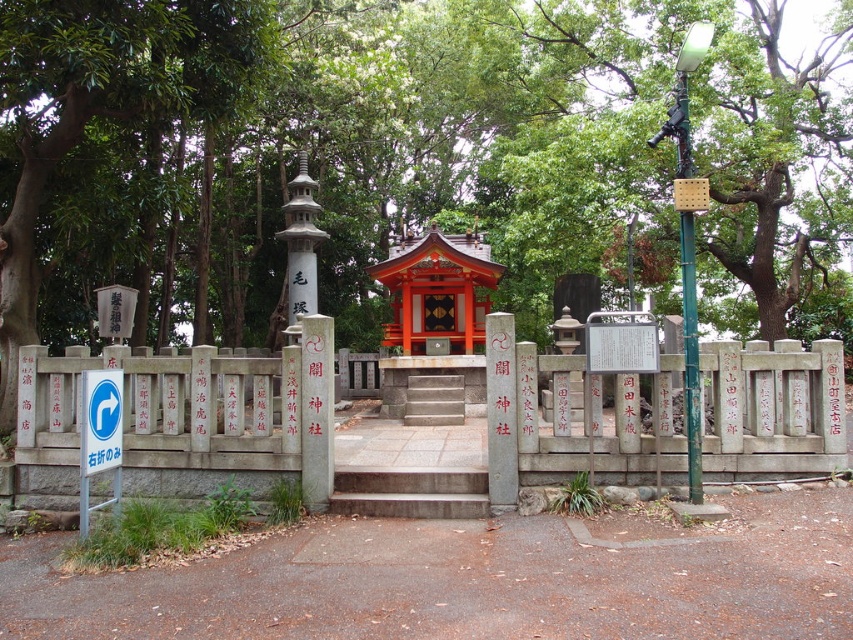
Question: Does gray stone fence at center lie in front of orange lacquered shrine at center?

Choices:
 (A) yes
 (B) no

Answer: (A)

Question: Which of these objects is positioned farthest from the concrete stairs at center?

Choices:
 (A) gray stone fence at center
 (B) gray stone stairs at center

Answer: (B)

Question: Which of the following is the closest to the observer?

Choices:
 (A) (372, 506)
 (B) (213, 276)
 (C) (39, 387)

Answer: (A)

Question: Does orange lacquered shrine at center come in front of white plastic sign at center?

Choices:
 (A) no
 (B) yes

Answer: (A)

Question: Is green leafy tree at center closer to the viewer compared to concrete stairs at center?

Choices:
 (A) yes
 (B) no

Answer: (B)

Question: Which point is farther from the camera taking this photo?

Choices:
 (A) (442, 401)
 (B) (119, 403)

Answer: (A)